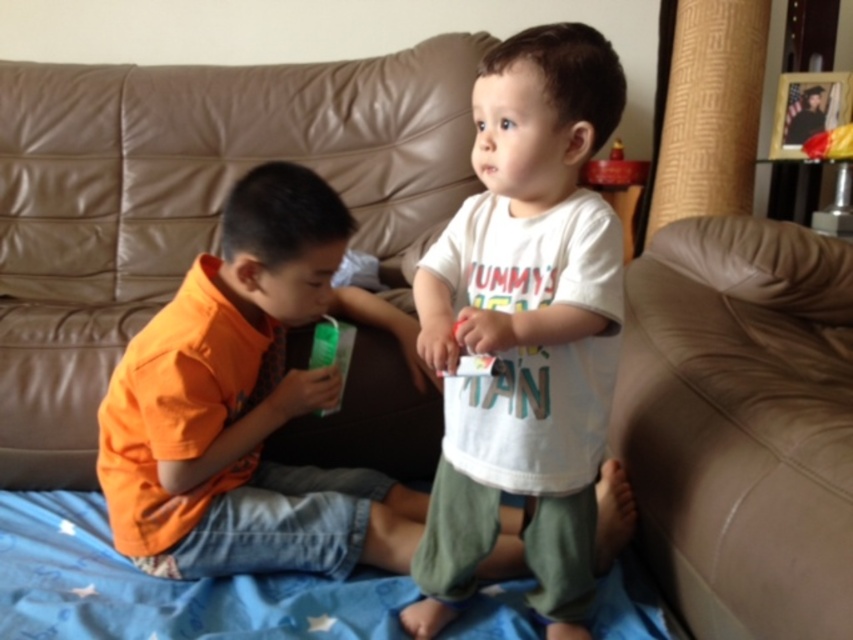
You are a photographer setting up a shoot in this living room. You want to ensure both the brown leather couch at center and the orange cotton shirt at center are visible in the frame. Is there any obstruction between them that might block the view?

The orange cotton shirt at center is behind the brown leather couch at center, so the couch partially obstructs the view of the shirt. Adjust your camera angle to capture both items without obstruction.

You are standing at point (793, 604) and want to walk to point (308, 104). Are you able to see the path directly between these two points without any obstructions?

Point (308, 104) is behind point (793, 604), so you cannot see the path directly between them because the point (793, 604) is blocking the view.

You are a photographer setting up for a family photo. You need to position two children wearing the white cotton shirt at center and orange cotton shirt at center so that one is in front of the other. Based on their current positions, which child should you place in front to maintain the same spatial relationship?

The white cotton shirt at center should be placed in front because it is already closer to the viewer than the orange cotton shirt at center, so maintaining that position keeps the original spatial relationship.